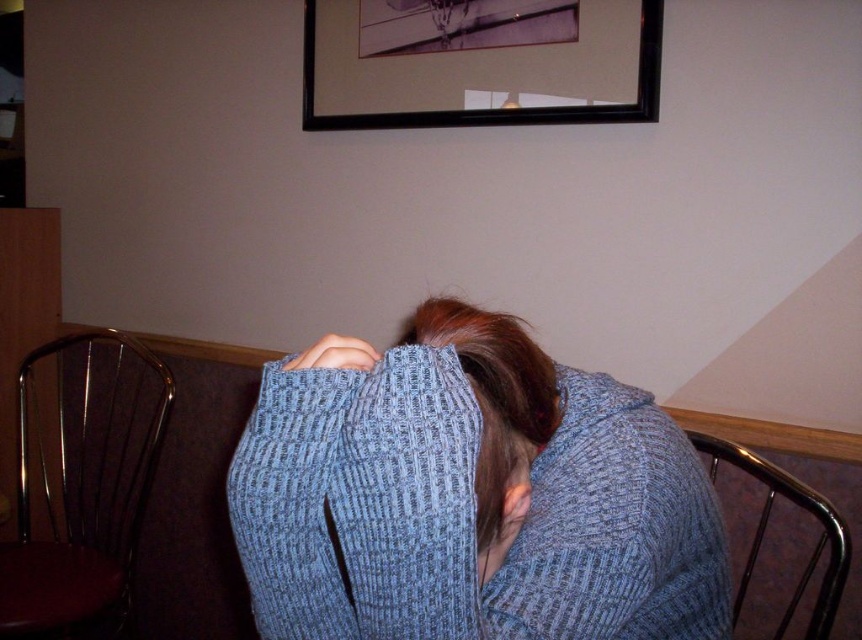
Question: Among these objects, which one is farthest from the camera?

Choices:
 (A) smooth skin ear at center
 (B) black matte picture frame at upper center
 (C) blue knitted sweater at center
 (D) metallic silver chair at lower right

Answer: (B)

Question: Estimate the real-world distances between objects in this image. Which object is farther from the metallic brown chair at left?

Choices:
 (A) matte blue sweater at center
 (B) blue knitted sweater at center
 (C) smooth skin ear at center

Answer: (C)

Question: Is metallic brown chair at left wider than blue knitted hair at center?

Choices:
 (A) yes
 (B) no

Answer: (A)

Question: Is the position of blue knitted sweater at center less distant than that of black matte picture frame at upper center?

Choices:
 (A) yes
 (B) no

Answer: (A)

Question: From the image, what is the correct spatial relationship of blue knitted sweater at center in relation to black matte picture frame at upper center?

Choices:
 (A) below
 (B) above

Answer: (A)

Question: Considering the real-world distances, which object is closest to the smooth skin ear at center?

Choices:
 (A) metallic brown chair at left
 (B) black matte picture frame at upper center
 (C) blue knitted sweater at center
 (D) metallic silver chair at lower right

Answer: (C)